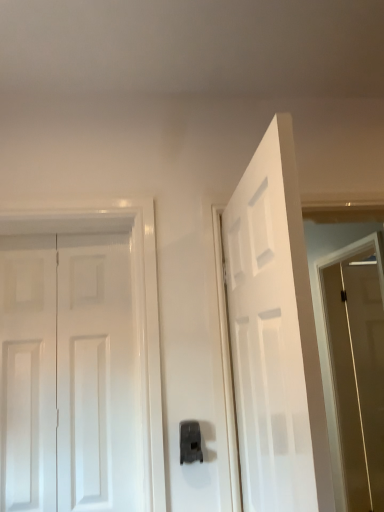
Question: Does black plastic door handle at center lie in front of brown matte screen door at right?

Choices:
 (A) no
 (B) yes

Answer: (B)

Question: Is brown matte screen door at right inside black plastic door handle at center?

Choices:
 (A) yes
 (B) no

Answer: (B)

Question: From the image's perspective, is black plastic door handle at center under brown matte screen door at right?

Choices:
 (A) no
 (B) yes

Answer: (A)

Question: Is black plastic door handle at center smaller than brown matte screen door at right?

Choices:
 (A) no
 (B) yes

Answer: (B)

Question: Is black plastic door handle at center outside brown matte screen door at right?

Choices:
 (A) no
 (B) yes

Answer: (B)

Question: From a real-world perspective, is white glossy door at left, arranged as the 1th door when viewed from the left, positioned above or below white matte door at center, arranged as the 1th door when viewed from the right?

Choices:
 (A) below
 (B) above

Answer: (A)

Question: From the image's perspective, is white glossy door at left, which ranks as the 2th door in right-to-left order, positioned above or below white matte door at center, the 2th door when ordered from left to right?

Choices:
 (A) above
 (B) below

Answer: (B)

Question: In the image, is white glossy door at left, which ranks as the 2th door in right-to-left order, positioned in front of or behind white matte door at center, the 2th door when ordered from left to right?

Choices:
 (A) front
 (B) behind

Answer: (B)

Question: Choose the correct answer: Is white glossy door at left, which ranks as the 2th door in right-to-left order, inside white matte door at center, arranged as the 1th door when viewed from the right, or outside it?

Choices:
 (A) inside
 (B) outside

Answer: (B)

Question: Is black plastic door handle at center wider or thinner than brown matte screen door at right?

Choices:
 (A) thin
 (B) wide

Answer: (A)

Question: From a real-world perspective, is black plastic door handle at center positioned above or below brown matte screen door at right?

Choices:
 (A) above
 (B) below

Answer: (A)

Question: Considering the relative positions of black plastic door handle at center and brown matte screen door at right in the image provided, is black plastic door handle at center to the left or to the right of brown matte screen door at right?

Choices:
 (A) right
 (B) left

Answer: (B)

Question: From the image's perspective, is black plastic door handle at center located above or below brown matte screen door at right?

Choices:
 (A) below
 (B) above

Answer: (B)

Question: Is white glossy door at left, arranged as the 1th door when viewed from the left, spatially inside black plastic door handle at center, or outside of it?

Choices:
 (A) outside
 (B) inside

Answer: (A)

Question: From the image's perspective, is white glossy door at left, arranged as the 1th door when viewed from the left, above or below black plastic door handle at center?

Choices:
 (A) below
 (B) above

Answer: (B)